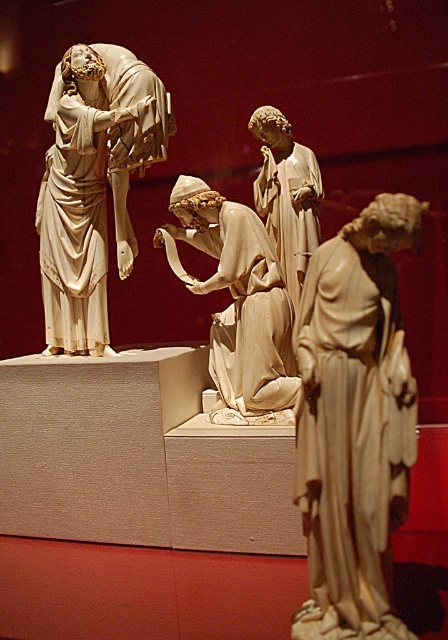
Question: Which object is the farthest from the matte beige statue at center?

Choices:
 (A) smooth beige statue at center
 (B) matte white statue at center
 (C) white marble statue at left

Answer: (C)

Question: Is white marble statue at left closer to the viewer compared to matte white statue at center?

Choices:
 (A) no
 (B) yes

Answer: (B)

Question: Does white marble statue at left have a larger size compared to matte white statue at center?

Choices:
 (A) no
 (B) yes

Answer: (B)

Question: Which of these objects is positioned closest to the smooth beige statue at center?

Choices:
 (A) matte white statue at center
 (B) white marble statue at left
 (C) matte beige statue at center

Answer: (A)

Question: Which point is closer to the camera taking this photo?

Choices:
 (A) click(x=345, y=340)
 (B) click(x=78, y=278)
 (C) click(x=245, y=316)
 (D) click(x=305, y=212)

Answer: (A)

Question: Is smooth beige statue at center in front of matte white statue at center?

Choices:
 (A) yes
 (B) no

Answer: (A)